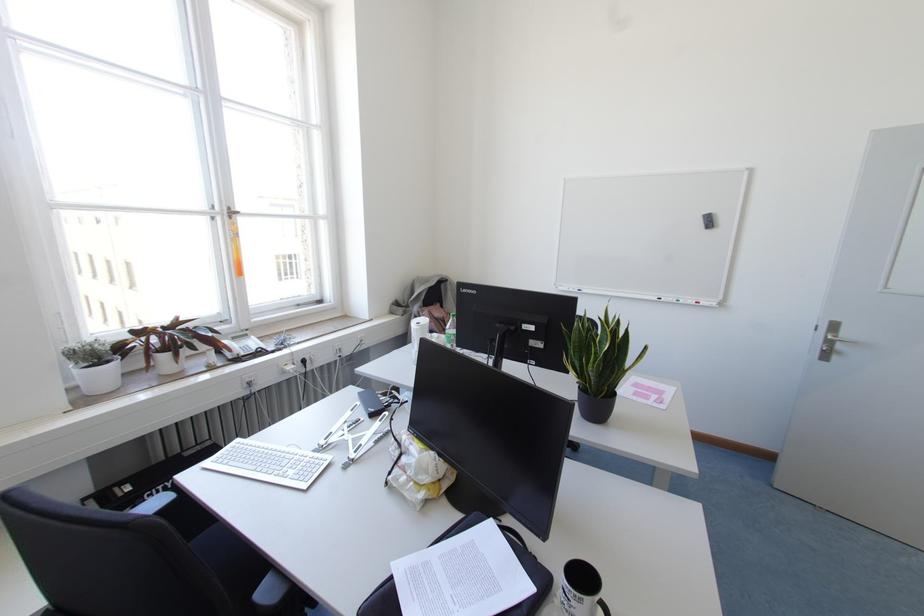
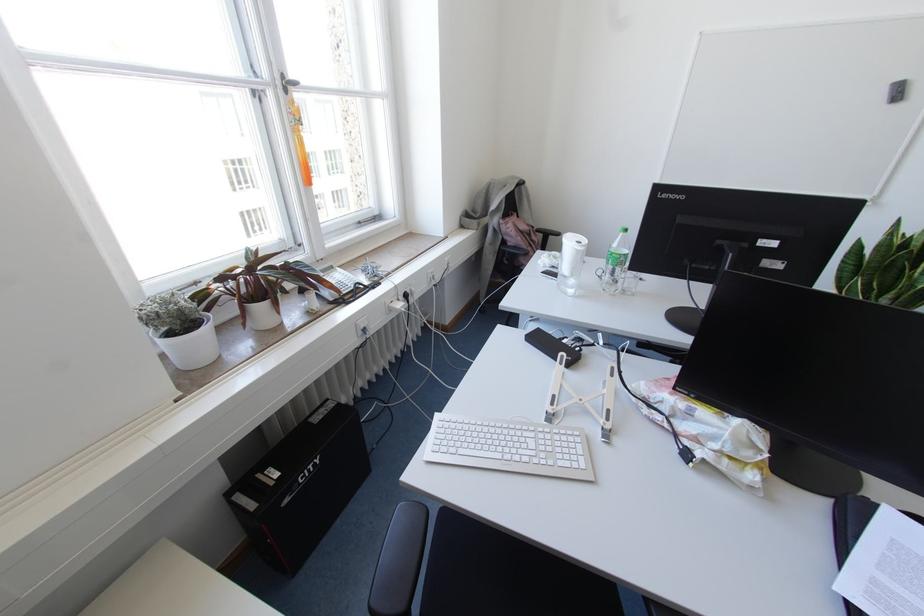
Where in the second image is the point corresponding to pixel 454 315 from the first image?

(625, 229)